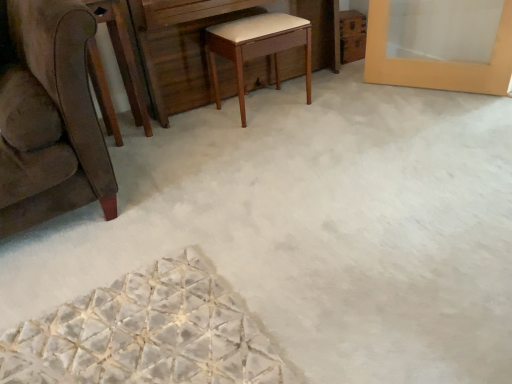
Question: From a real-world perspective, is wooden vanity at center positioned under light brown wood stool at center based on gravity?

Choices:
 (A) yes
 (B) no

Answer: (B)

Question: From the image's perspective, does wooden vanity at center appear lower than light brown wood stool at center?

Choices:
 (A) no
 (B) yes

Answer: (A)

Question: From a real-world perspective, is wooden vanity at center on light brown wood stool at center?

Choices:
 (A) no
 (B) yes

Answer: (B)

Question: Can you confirm if wooden vanity at center is positioned to the right of light brown wood stool at center?

Choices:
 (A) no
 (B) yes

Answer: (A)

Question: Would you say wooden vanity at center is a long distance from light brown wood stool at center?

Choices:
 (A) no
 (B) yes

Answer: (A)

Question: Is light brown wood stool at center inside wooden vanity at center?

Choices:
 (A) yes
 (B) no

Answer: (A)

Question: Is the depth of light brown wood stool at center greater than that of wooden vanity at center?

Choices:
 (A) no
 (B) yes

Answer: (B)

Question: Is light brown wood stool at center thinner than wooden vanity at center?

Choices:
 (A) yes
 (B) no

Answer: (A)

Question: Can you confirm if light brown wood stool at center is shorter than wooden vanity at center?

Choices:
 (A) yes
 (B) no

Answer: (A)

Question: From the image's perspective, does light brown wood stool at center appear higher than wooden vanity at center?

Choices:
 (A) yes
 (B) no

Answer: (B)

Question: Considering the relative positions of light brown wood stool at center and wooden vanity at center in the image provided, is light brown wood stool at center to the left of wooden vanity at center from the viewer's perspective?

Choices:
 (A) no
 (B) yes

Answer: (A)

Question: From a real-world perspective, is light brown wood stool at center below wooden vanity at center?

Choices:
 (A) yes
 (B) no

Answer: (A)

Question: Is brown wood round table at left at the right side of light brown wood stool at center?

Choices:
 (A) no
 (B) yes

Answer: (A)